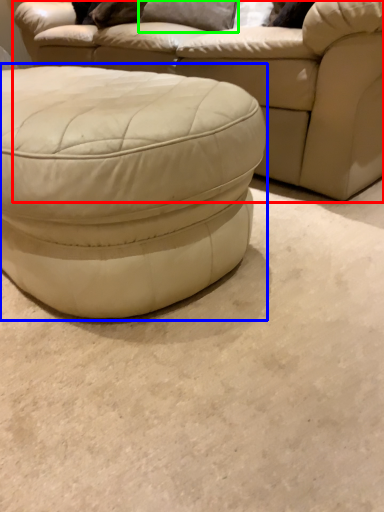
Question: Which is nearer to the studio couch (highlighted by a red box)? stool (highlighted by a blue box) or pillow (highlighted by a green box).

Choices:
 (A) stool
 (B) pillow

Answer: (B)